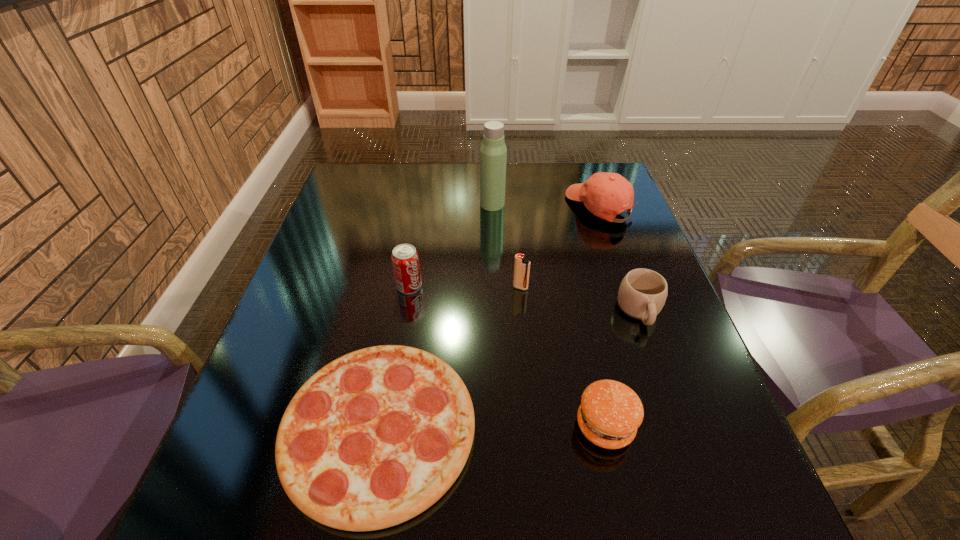
Image resolution: width=960 pixels, height=540 pixels. Identify the location of object that is the fifth closest one to the tallest object. (374, 438).

The width and height of the screenshot is (960, 540). Find the location of `free spot that satisfies the following two spatial constraints: 1. on the back side of the fourth object from left to right; 2. on the left side of the baseball cap`. free spot that satisfies the following two spatial constraints: 1. on the back side of the fourth object from left to right; 2. on the left side of the baseball cap is located at coordinates (513, 207).

Image resolution: width=960 pixels, height=540 pixels. In order to click on free space that satisfies the following two spatial constraints: 1. on the back side of the patty; 2. on the right side of the pizza in this screenshot , I will do point(380,426).